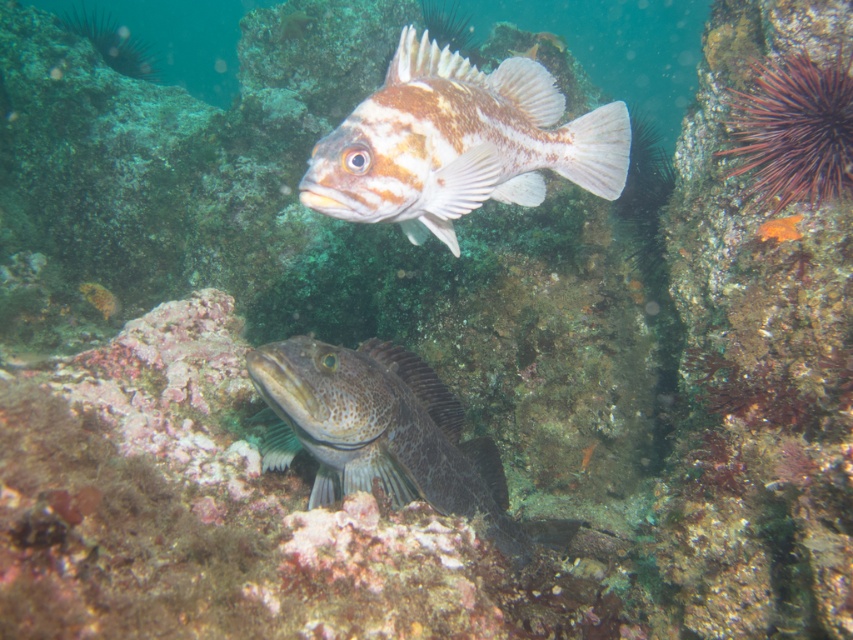
You are a marine biologist observing an underwater scene. You notice two fish, a speckled brown fish at upper center and a speckled dark gray fish at lower center. Which fish is positioned to the right of the other?

The speckled brown fish at upper center is to the right of the speckled dark gray fish at lower center.

You are a marine biologist observing an underwater scene with a speckled brown fish at upper center and a speckled dark gray fish at lower center. Which fish is located higher in the water column?

The speckled brown fish at upper center is positioned over the speckled dark gray fish at lower center, so it is higher in the water column.

You are a marine biologist observing two points in an underwater scene. The first point is labeled as point (506, 170) and the second is point (463, 460). Which of these two points is nearer to you?

Point (506, 170) is closer to the viewer than point (463, 460).